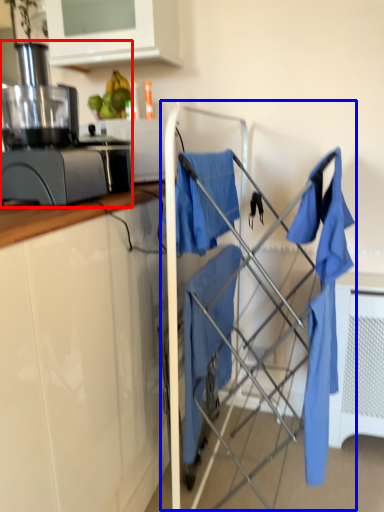
Question: Among these objects, which one is farthest to the camera, home appliance (highlighted by a red box) or baby carriage (highlighted by a blue box)?

Choices:
 (A) home appliance
 (B) baby carriage

Answer: (B)